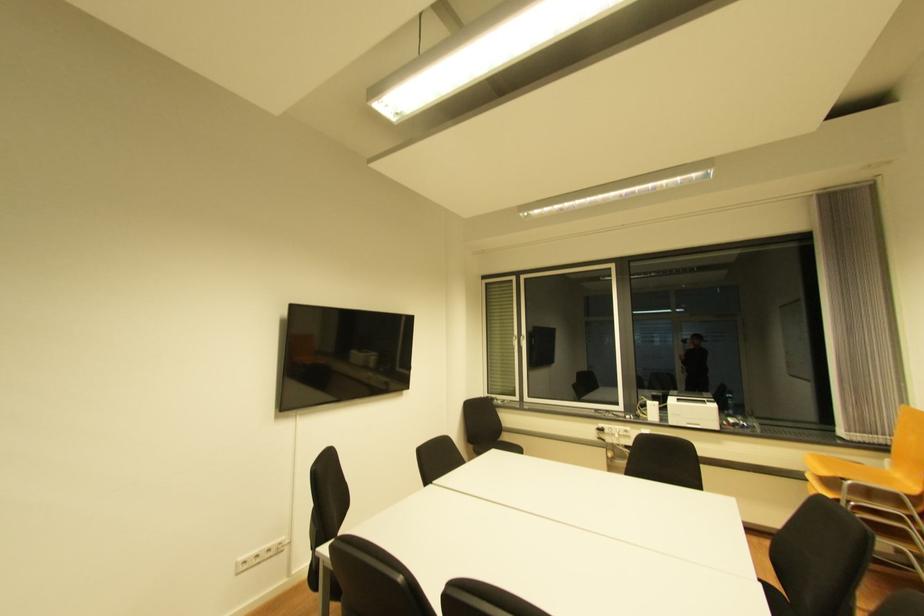
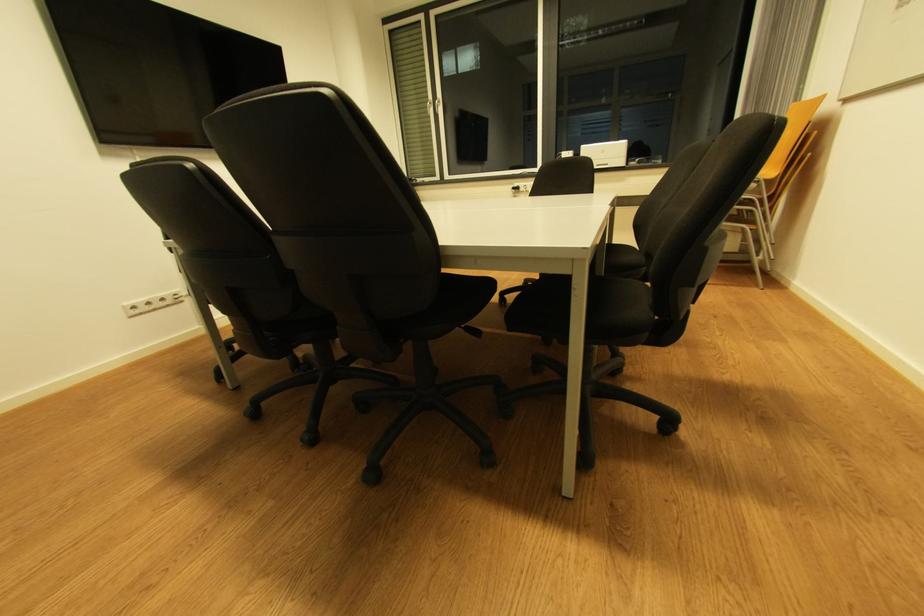
Question: How did the camera likely rotate?

Choices:
 (A) Left
 (B) Right
 (C) Up
 (D) Down

Answer: (D)